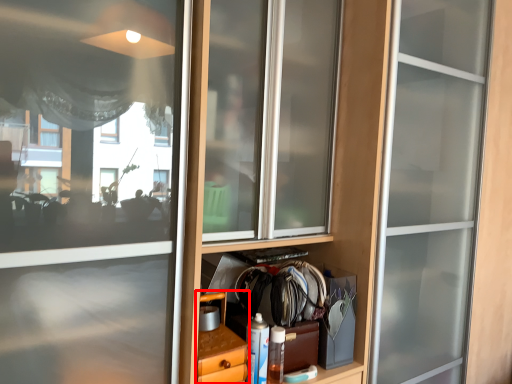
Question: From the image's perspective, where is cabinetry (annotated by the red box) located relative to bottle?

Choices:
 (A) below
 (B) above

Answer: (B)